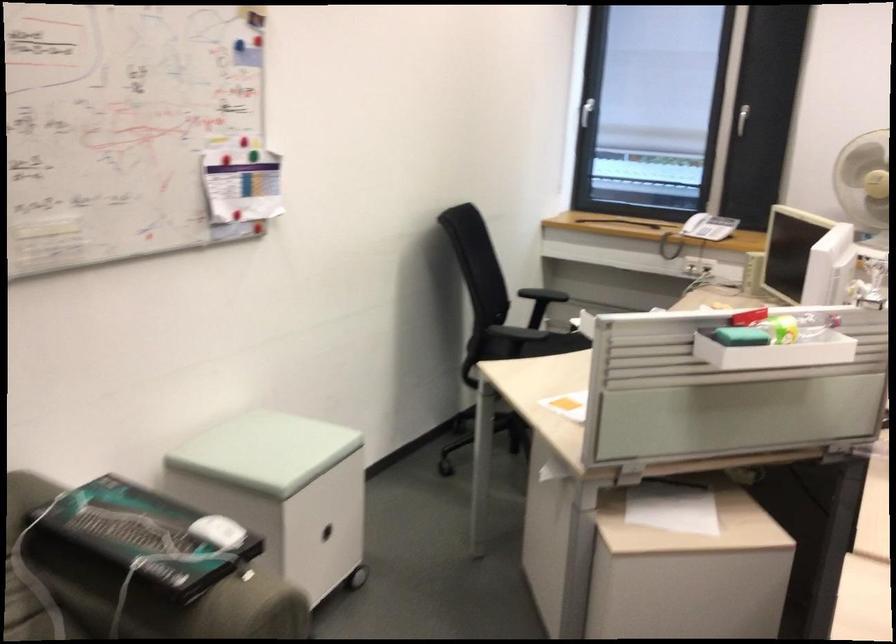
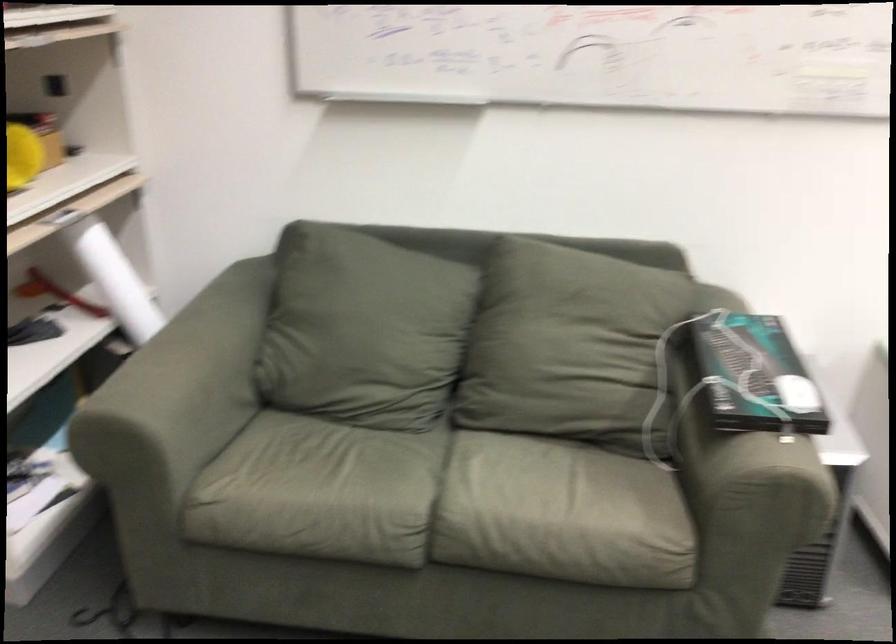
The first image is from the beginning of the video and the second image is from the end. How did the camera likely rotate when shooting the video?

The camera rotated toward left-down.